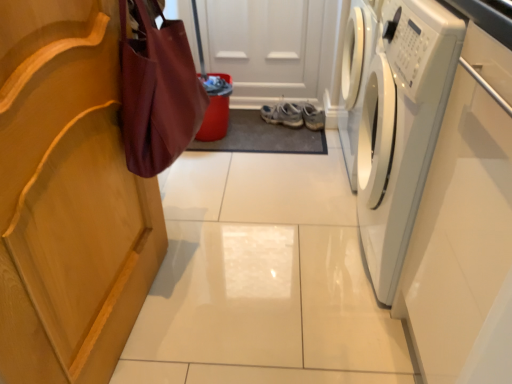
Image resolution: width=512 pixels, height=384 pixels. Find the location of `vacant space to the left of light blue fabric sneakers at center`. vacant space to the left of light blue fabric sneakers at center is located at coordinates (253, 126).